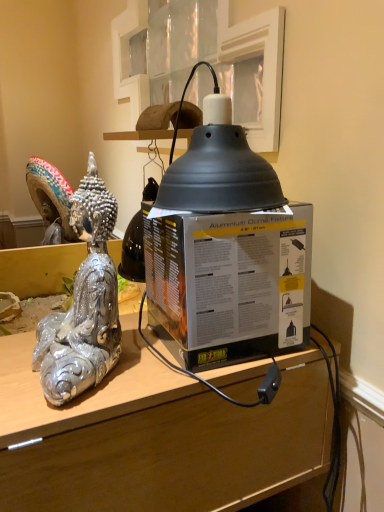
This screenshot has height=512, width=384. What do you see at coordinates (157, 436) in the screenshot?
I see `matte black box at center` at bounding box center [157, 436].

Describe the element at coordinates (217, 167) in the screenshot. This screenshot has width=384, height=512. I see `matte black dome at upper center` at that location.

Where is `matte black box at center`? This screenshot has height=512, width=384. matte black box at center is located at coordinates [157, 436].

Is matte black box at center bigger than shiny silver statue at left?

Yes.

Considering the relative sizes of matte black box at center and shiny silver statue at left in the image provided, is matte black box at center shorter than shiny silver statue at left?

Correct, matte black box at center is not as tall as shiny silver statue at left.

Can you confirm if matte black box at center is thinner than shiny silver statue at left?

No.

Is point (289, 214) less distant than point (92, 182)?

No, it is behind (92, 182).

Are matte black dome at upper center and matte black box at center far apart?

No, matte black dome at upper center is not far away from matte black box at center.

From the picture: Considering the relative sizes of matte black dome at upper center and matte black box at center in the image provided, is matte black dome at upper center smaller than matte black box at center?

Indeed, matte black dome at upper center has a smaller size compared to matte black box at center.

From the image's perspective, who appears lower, matte black dome at upper center or matte black box at center?

From the image's view, matte black box at center is below.

From a real-world perspective, who is located lower, matte black dome at upper center or matte black box at center?

matte black box at center.

How many degrees apart are the facing directions of matte black dome at upper center and matte black box at center?

They differ by 1.82 degrees in their facing directions.

From a real-world perspective, is matte black dome at upper center beneath matte black box at center?

Actually, matte black dome at upper center is physically above matte black box at center in the real world.

Is matte black dome at upper center directly adjacent to matte black box at center?

No.

How far apart are matte black dome at upper center and matte black box at center?

The distance of matte black dome at upper center from matte black box at center is 10.03 centimeters.

Is matte black dome at upper center in front of or behind shiny silver statue at left in the image?

Visually, matte black dome at upper center is located behind shiny silver statue at left.

Is matte black dome at upper center positioned far away from shiny silver statue at left?

No, matte black dome at upper center is in close proximity to shiny silver statue at left.

From the image's perspective, is matte black dome at upper center located beneath shiny silver statue at left?

No, from the image's perspective, matte black dome at upper center is not beneath shiny silver statue at left.

Which is behind, point (282, 201) or point (94, 251)?

Point (94, 251)

From the image's perspective, is matte black box at center above or below matte black box at center?

Based on their image positions, matte black box at center is located above matte black box at center.

Are matte black box at center and matte black box at center beside each other?

No, matte black box at center is not touching matte black box at center.

From a real-world perspective, does matte black box at center stand above matte black box at center?

Yes, from a real-world perspective, matte black box at center is above matte black box at center.

From the image's perspective, which one is positioned lower, matte black box at center or matte black box at center?

matte black box at center.

From a real-world perspective, which is physically below, matte black box at center or matte black box at center?

matte black box at center.

Is matte black box at center touching matte black box at center?

No.

Is matte black box at center turned away from matte black box at center?

No, matte black box at center's orientation is not away from matte black box at center.

Is matte black box at center to the left of shiny silver statue at left from the viewer's perspective?

Yes.

Which of these two, matte black box at center or shiny silver statue at left, is smaller?

shiny silver statue at left.

Is matte black box at center further to camera compared to shiny silver statue at left?

That is True.

Identify the location of box to the right of shiny silver statue at left. The width and height of the screenshot is (384, 512). (230, 282).

Find the location of a particular element. This screenshot has width=384, height=512. oil lamp lying above the matte black box at center (from the image's perspective) is located at coordinates (217, 167).

Estimate the real-world distances between objects in this image. Which object is closer to shiny silver statue at left, matte black box at center or matte black dome at upper center?

matte black box at center lies closer to shiny silver statue at left than the other object.

Looking at the image, which one is located closer to matte black box at center, shiny silver statue at left or matte black dome at upper center?

Based on the image, matte black dome at upper center appears to be nearer to matte black box at center.

When comparing their distances from matte black dome at upper center, does matte black box at center or matte black box at center seem further?

matte black box at center lies further to matte black dome at upper center than the other object.

Based on their spatial positions, is matte black box at center or matte black dome at upper center closer to matte black box at center?

matte black box at center lies closer to matte black box at center than the other object.

Looking at the image, which one is located closer to shiny silver statue at left, matte black box at center or matte black dome at upper center?

Based on the image, matte black dome at upper center appears to be nearer to shiny silver statue at left.

Looking at the image, which one is located closer to matte black box at center, matte black box at center or shiny silver statue at left?

Based on the image, matte black box at center appears to be nearer to matte black box at center.

Considering their positions, is matte black box at center positioned further to matte black dome at upper center than shiny silver statue at left?

matte black box at center is positioned further to the anchor matte black dome at upper center.

From the picture: Considering their positions, is matte black box at center positioned further to shiny silver statue at left than matte black box at center?

matte black box at center.

Identify the location of oil lamp located between shiny silver statue at left and matte black box at center in the left-right direction. This screenshot has width=384, height=512. (217, 167).

This screenshot has height=512, width=384. I want to click on figurine between matte black box at center and matte black box at center from left to right, so click(x=84, y=303).

At what (x,y) coordinates should I click in order to perform the action: click on box between matte black dome at upper center and matte black box at center in the vertical direction. Please return your answer as a coordinate pair (x, y). Looking at the image, I should click on (230, 282).

At what (x,y) coordinates should I click in order to perform the action: click on figurine that lies between matte black dome at upper center and matte black box at center from top to bottom. Please return your answer as a coordinate pair (x, y). Looking at the image, I should click on (84, 303).